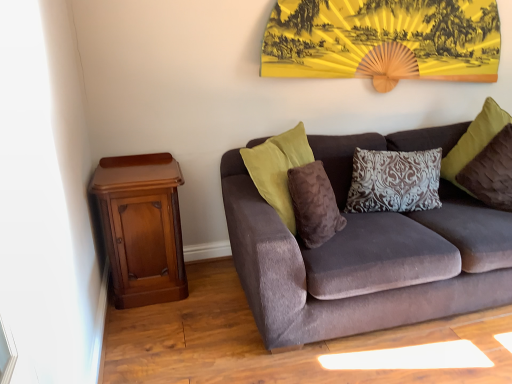
The image size is (512, 384). In order to click on vacant area that lies between mahogany wood nightstand at left and velvet brown couch at center in this screenshot , I will do `click(196, 312)`.